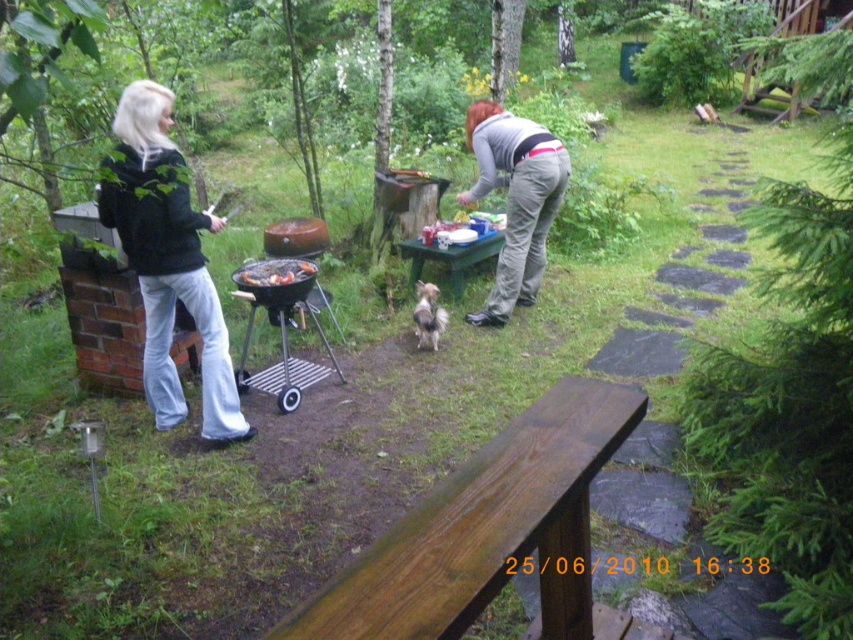
From the picture: You are planning to place a small table exactly at the point marked as point (276,273). Considering the existing grilled meat at center located there, is this placement feasible?

The grilled meat at center is located at point (276,273), so placing a small table there would require moving the grilled meat as the location is already occupied.

You are standing in the backyard and want to place a small potted plant between the brown wooden picnic table at lower center and the gray cotton pants at center. Which object should the plant be closer to if you want it to be closer to the viewer?

The plant should be placed closer to the brown wooden picnic table at lower center because it is already closer to the viewer than the gray cotton pants at center.